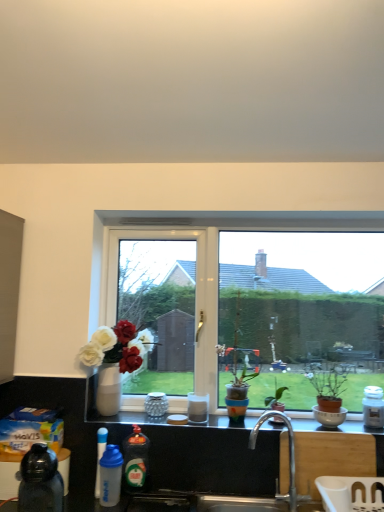
Where is `vacant space in front of porcelain textured cup at window, which is the second coffee cup in right-to-left order`? This screenshot has width=384, height=512. vacant space in front of porcelain textured cup at window, which is the second coffee cup in right-to-left order is located at coordinates (148, 425).